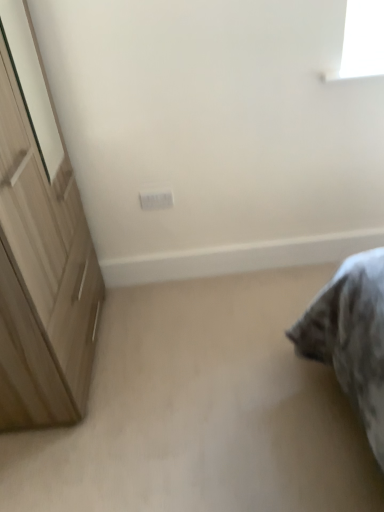
Question: Does light brown wooden cupboard at left come behind white plastic electric outlet at center?

Choices:
 (A) yes
 (B) no

Answer: (B)

Question: Is light brown wooden cupboard at left aimed at white plastic electric outlet at center?

Choices:
 (A) yes
 (B) no

Answer: (A)

Question: Is light brown wooden cupboard at left wider than white plastic electric outlet at center?

Choices:
 (A) no
 (B) yes

Answer: (B)

Question: Considering the relative positions of light brown wooden cupboard at left and white plastic electric outlet at center in the image provided, is light brown wooden cupboard at left in front of white plastic electric outlet at center?

Choices:
 (A) yes
 (B) no

Answer: (A)

Question: Can you confirm if light brown wooden cupboard at left is shorter than white plastic electric outlet at center?

Choices:
 (A) yes
 (B) no

Answer: (B)

Question: Is point (74, 369) positioned closer to the camera than point (152, 203)?

Choices:
 (A) closer
 (B) farther

Answer: (A)

Question: Is light brown wooden cupboard at left bigger or smaller than white plastic electric outlet at center?

Choices:
 (A) small
 (B) big

Answer: (B)

Question: Is light brown wooden cupboard at left in front of or behind white plastic electric outlet at center in the image?

Choices:
 (A) front
 (B) behind

Answer: (A)

Question: Choose the correct answer: Is light brown wooden cupboard at left inside white plastic electric outlet at center or outside it?

Choices:
 (A) outside
 (B) inside

Answer: (A)

Question: From the image's perspective, is white plastic electric outlet at center above or below light brown wooden cupboard at left?

Choices:
 (A) above
 (B) below

Answer: (A)

Question: Considering the positions of white plastic electric outlet at center and light brown wooden cupboard at left in the image, is white plastic electric outlet at center wider or thinner than light brown wooden cupboard at left?

Choices:
 (A) wide
 (B) thin

Answer: (B)

Question: Is point (168, 195) closer or farther from the camera than point (69, 361)?

Choices:
 (A) closer
 (B) farther

Answer: (B)

Question: Choose the correct answer: Is white plastic electric outlet at center inside light brown wooden cupboard at left or outside it?

Choices:
 (A) inside
 (B) outside

Answer: (B)

Question: Considering their positions, is beige carpet at lower right located in front of or behind white plastic electric outlet at center?

Choices:
 (A) front
 (B) behind

Answer: (A)

Question: In terms of width, does beige carpet at lower right look wider or thinner when compared to white plastic electric outlet at center?

Choices:
 (A) thin
 (B) wide

Answer: (B)